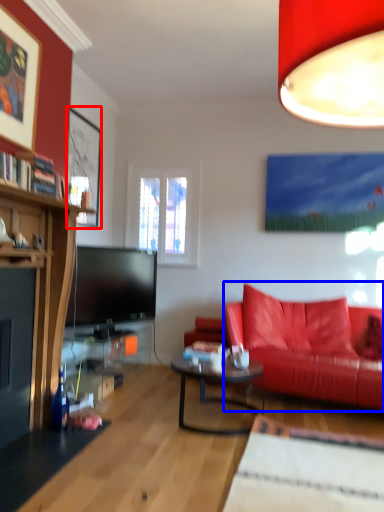
Question: Which object is closer to the camera taking this photo, picture frame (highlighted by a red box) or studio couch (highlighted by a blue box)?

Choices:
 (A) picture frame
 (B) studio couch

Answer: (B)